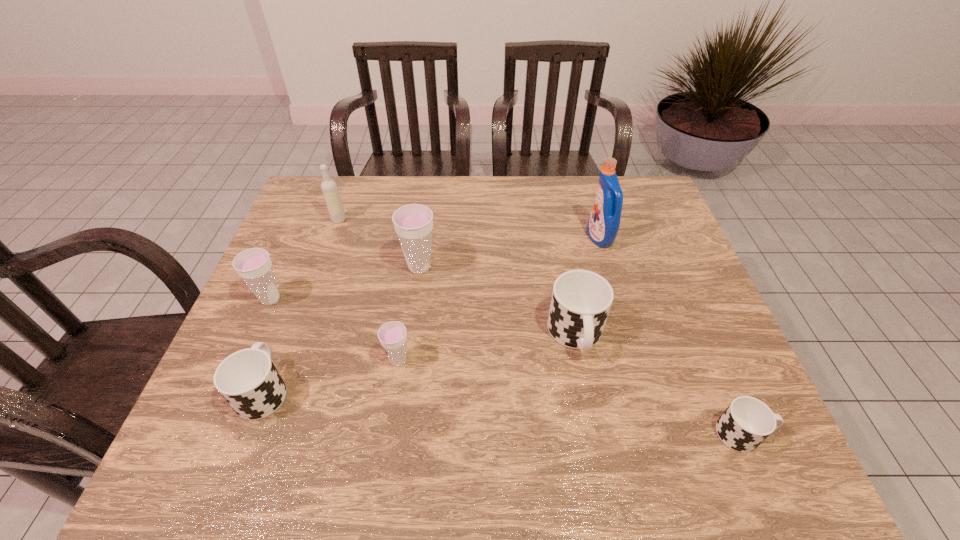
Locate an element on the screen. vacant position located 0.130m on the side of the second black cup from right to left with the handle is located at coordinates (592, 421).

Identify the location of vacant space located 0.130m on the back of the nearest purple cup. The height and width of the screenshot is (540, 960). tap(406, 307).

Where is `vacant space positioned on the side of the second smallest black cup with the handle`? The width and height of the screenshot is (960, 540). vacant space positioned on the side of the second smallest black cup with the handle is located at coordinates 319,246.

Where is `vacant space located 0.170m on the side of the second smallest black cup with the handle`? The image size is (960, 540). vacant space located 0.170m on the side of the second smallest black cup with the handle is located at coordinates (296, 306).

Where is `vacant position located 0.090m on the side of the second smallest black cup with the handle`? The image size is (960, 540). vacant position located 0.090m on the side of the second smallest black cup with the handle is located at coordinates (286, 330).

Image resolution: width=960 pixels, height=540 pixels. I want to click on object that is at the far edge, so click(329, 188).

The width and height of the screenshot is (960, 540). What are the coordinates of `object located in the near edge section of the desktop` in the screenshot? It's located at (747, 422).

Where is `vodka at the left edge`? This screenshot has width=960, height=540. vodka at the left edge is located at coordinates (329, 188).

Where is `object at the right edge`? The height and width of the screenshot is (540, 960). object at the right edge is located at coordinates (747, 422).

The width and height of the screenshot is (960, 540). Find the location of `object at the far left corner`. object at the far left corner is located at coordinates (329, 188).